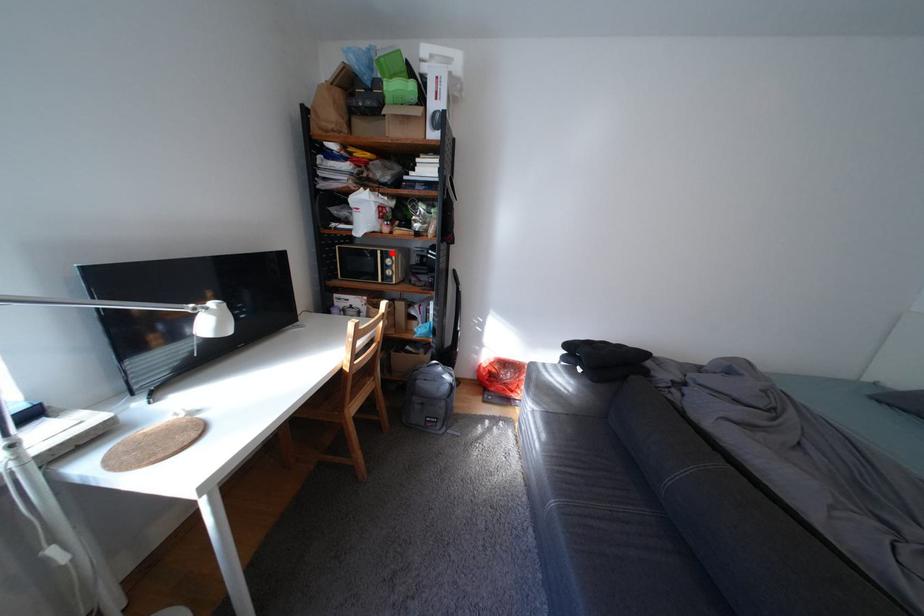
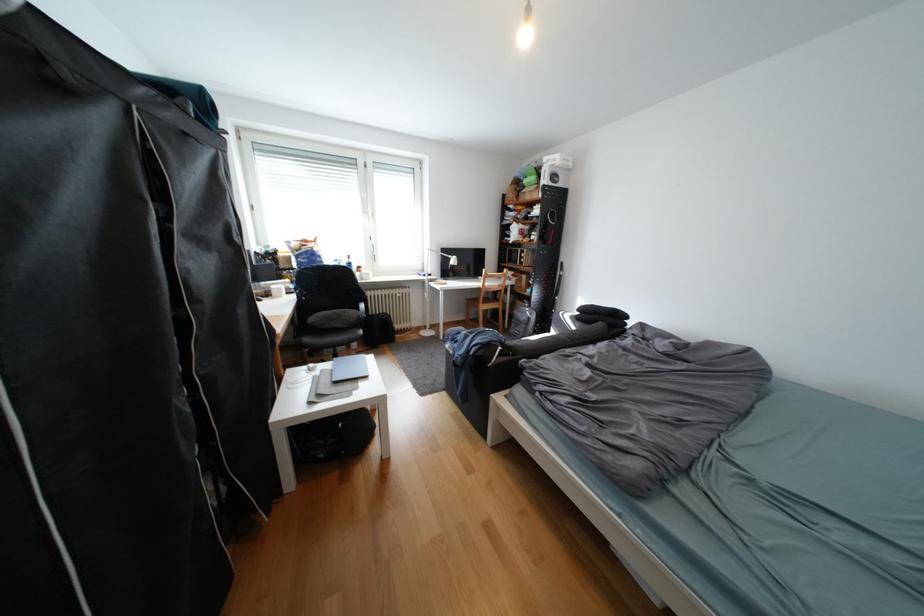
Question: I am providing you with two images of the same scene from different viewpoints. A red point is marked on the first image. At the location where the point appears in image 1, is it still visible in image 2?

Choices:
 (A) Yes
 (B) No

Answer: (B)